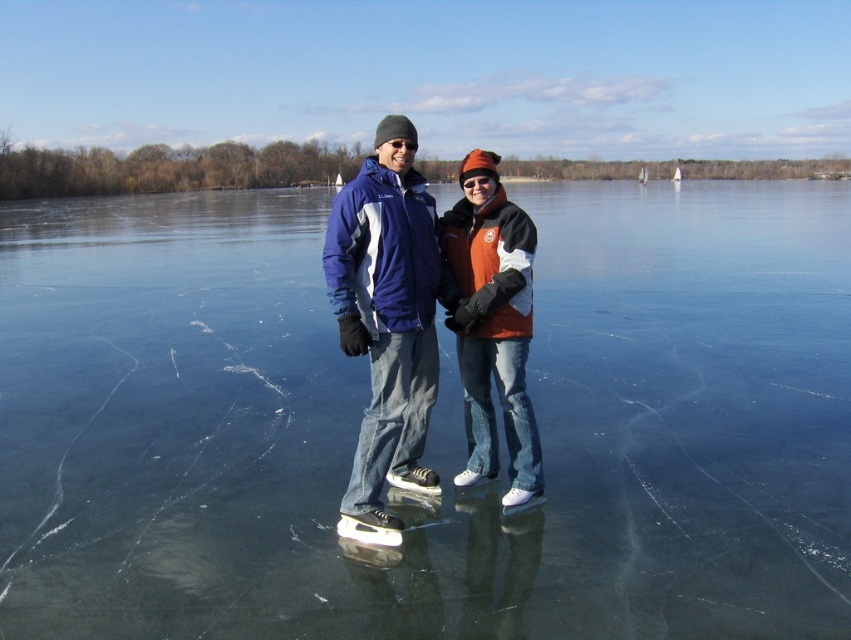
Question: Which point is farther to the camera?

Choices:
 (A) (400, 308)
 (B) (203, 422)

Answer: (B)

Question: Does transparent ice at center come in front of matte blue jacket at center?

Choices:
 (A) yes
 (B) no

Answer: (A)

Question: Which point is farther to the camera?

Choices:
 (A) (390, 410)
 (B) (261, 202)

Answer: (B)

Question: From the image, what is the correct spatial relationship of transparent ice at center in relation to matte blue jacket at center?

Choices:
 (A) below
 (B) above

Answer: (B)

Question: Which of the following is the closest to the observer?

Choices:
 (A) matte blue jacket at center
 (B) transparent ice at center

Answer: (B)

Question: Is transparent ice at center to the right of matte blue jacket at center from the viewer's perspective?

Choices:
 (A) yes
 (B) no

Answer: (B)